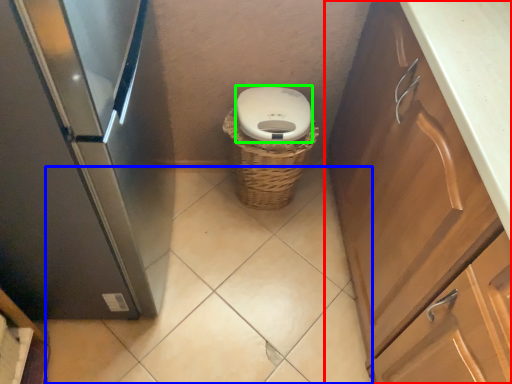
Question: Considering the real-world distances, which object is farthest from cabinetry (highlighted by a red box)? plain (highlighted by a blue box) or toilet bowl (highlighted by a green box)?

Choices:
 (A) plain
 (B) toilet bowl

Answer: (A)